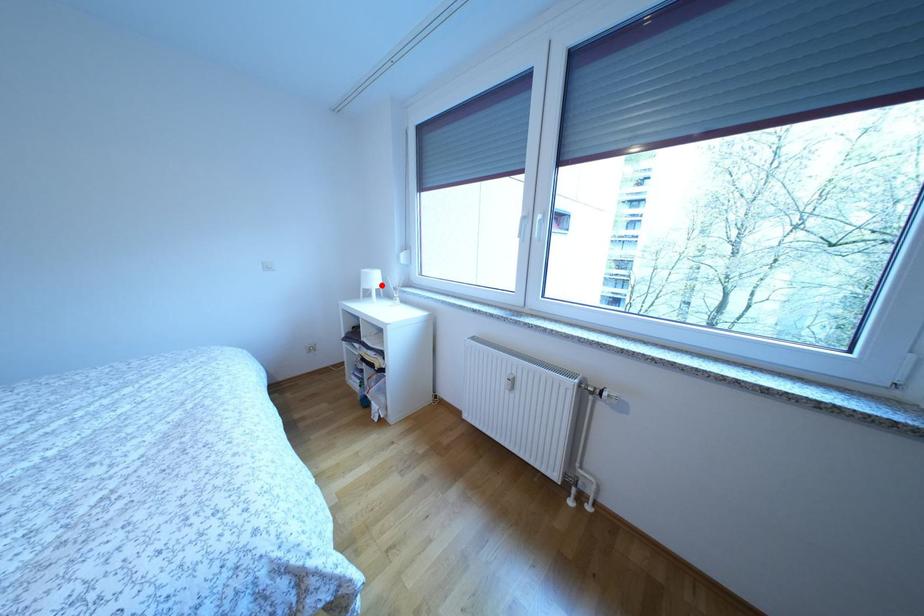
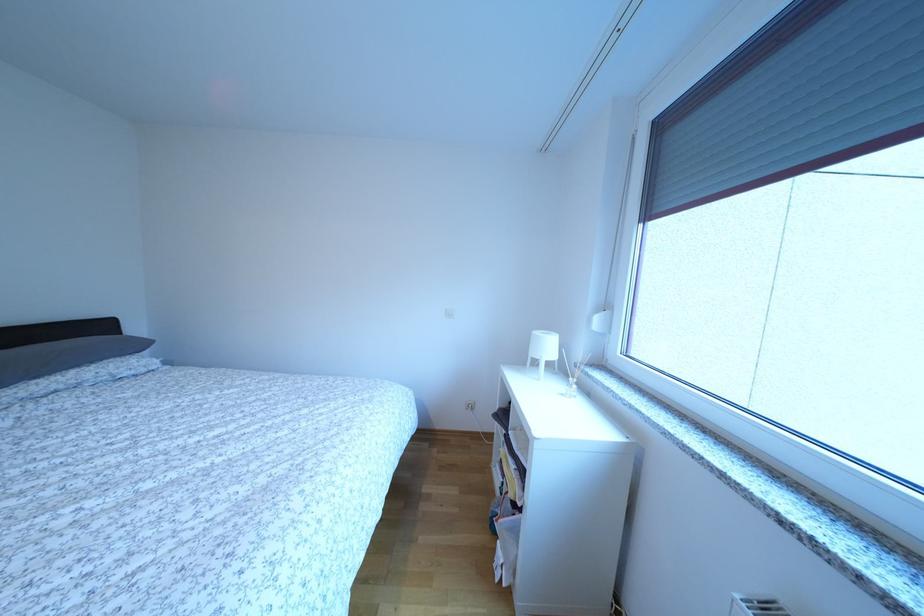
Question: A red point is marked in image1. In image2, is the corresponding 3D point closer to the camera or farther? Reply with the corresponding letter.

Choices:
 (A) The corresponding 3D point is closer.
 (B) The corresponding 3D point is farther.

Answer: (B)